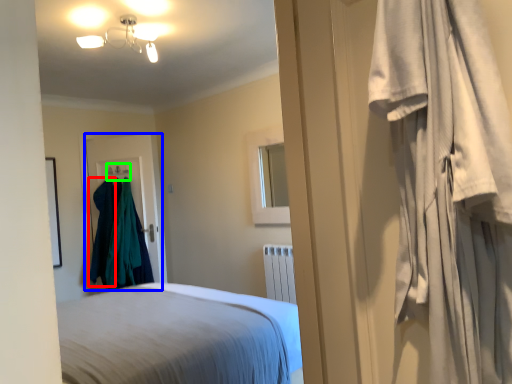
Question: Estimate the real-world distances between objects in this image. Which object is farther from clothing (highlighted by a red box), door (highlighted by a blue box) or hanger (highlighted by a green box)?

Choices:
 (A) door
 (B) hanger

Answer: (B)